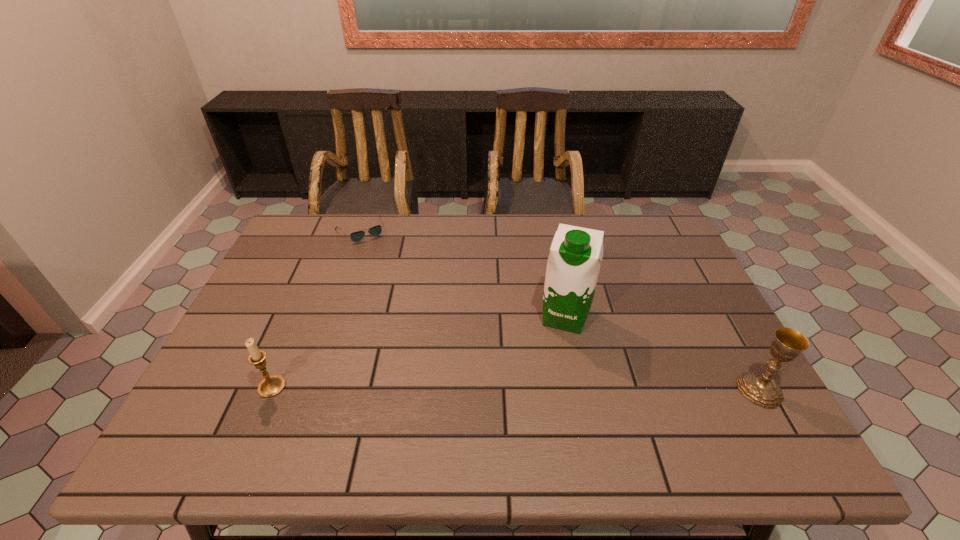
What are the coordinates of `object located in the far left corner section of the desktop` in the screenshot? It's located at 357,236.

The height and width of the screenshot is (540, 960). In order to click on object that is at the near left corner in this screenshot , I will do `click(270, 386)`.

Where is `object at the near right corner`? This screenshot has height=540, width=960. object at the near right corner is located at coordinates (760, 388).

Locate an element on the screen. vacant space at the far edge of the desktop is located at coordinates (446, 225).

Find the location of `vacant space at the near edge`. vacant space at the near edge is located at coordinates (362, 406).

Find the location of `vacant space at the left edge of the desktop`. vacant space at the left edge of the desktop is located at coordinates (283, 321).

Find the location of a particular element. vacant space at the right edge is located at coordinates (690, 292).

In the image, there is a desktop. At what (x,y) coordinates should I click in order to perform the action: click on vacant region at the far left corner. Please return your answer as a coordinate pair (x, y). Image resolution: width=960 pixels, height=540 pixels. Looking at the image, I should click on tap(332, 248).

Find the location of a particular element. The height and width of the screenshot is (540, 960). free point at the near left corner is located at coordinates (231, 407).

This screenshot has width=960, height=540. Find the location of `blank area at the far right corner`. blank area at the far right corner is located at coordinates [628, 221].